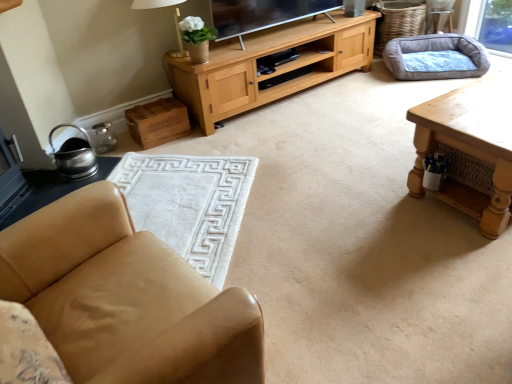
I want to click on vacant space situated above white soft rug at lower left (from a real-world perspective), so click(x=176, y=193).